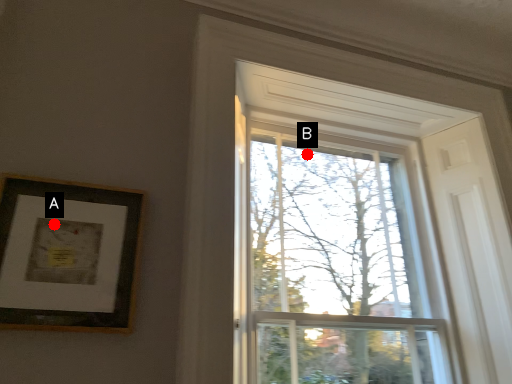
Question: Two points are circled on the image, labeled by A and B beside each circle. Among these points, which one is nearest to the camera?

Choices:
 (A) A is closer
 (B) B is closer

Answer: (A)